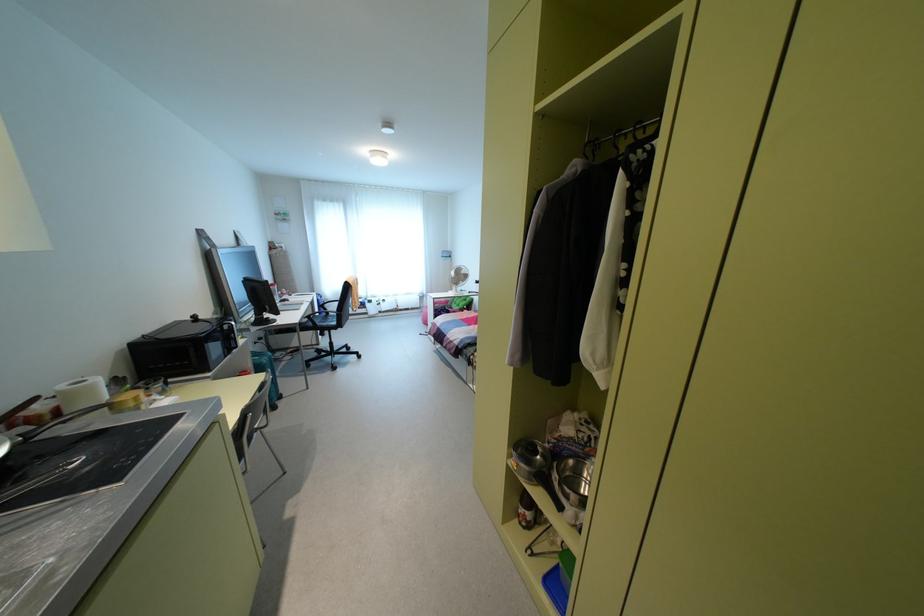
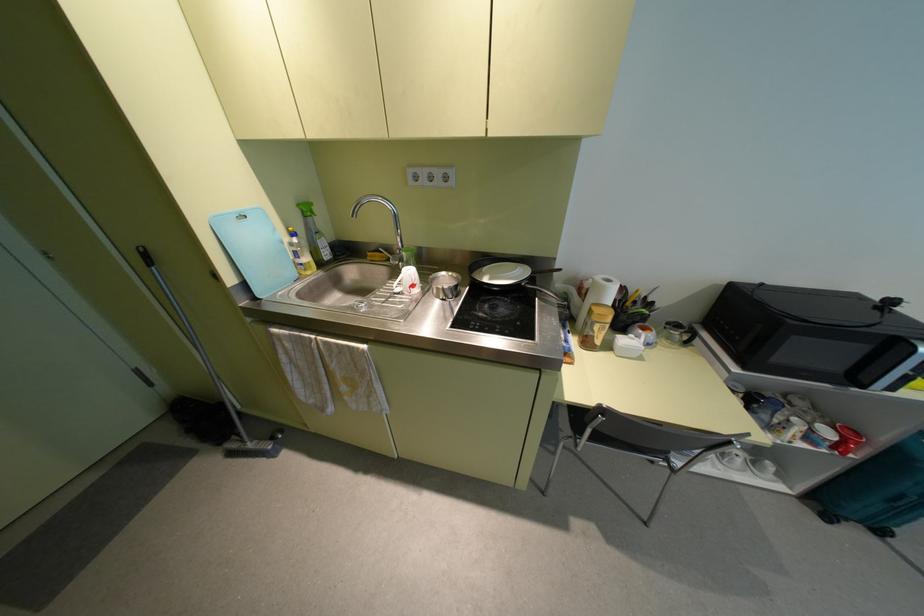
Where in the second image is the point corresponding to pixel 62 387 from the first image?

(599, 277)